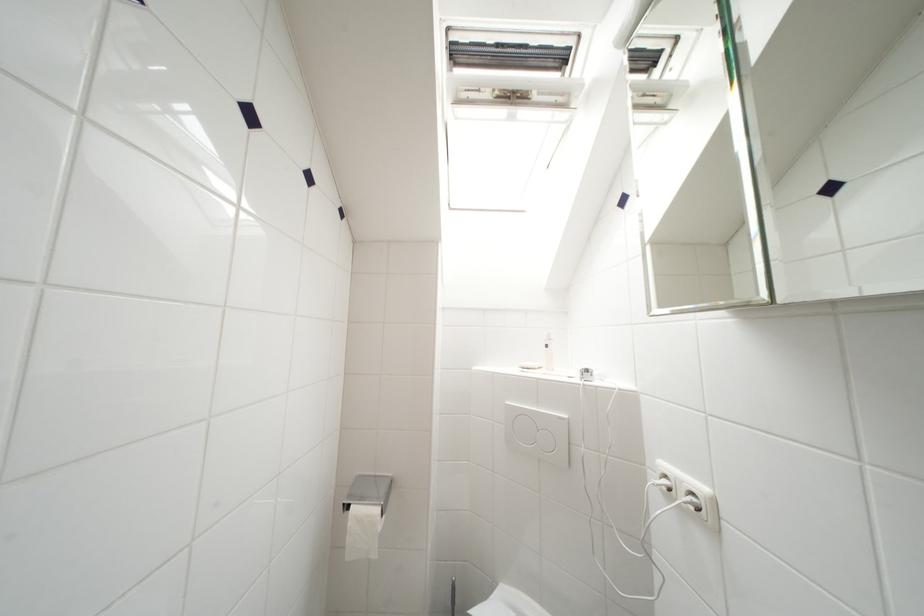
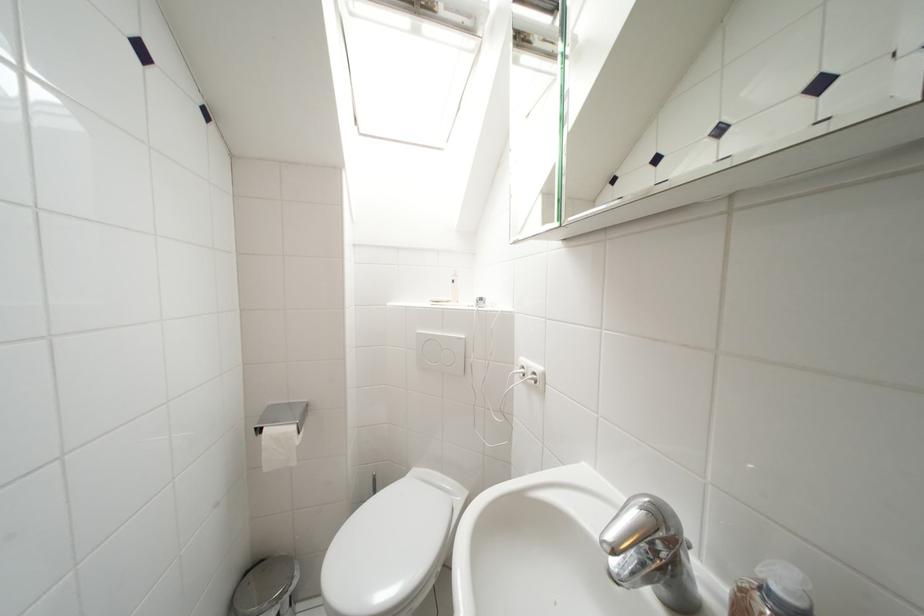
Locate, in the second image, the point that corresponds to (699,498) in the first image.

(541, 377)